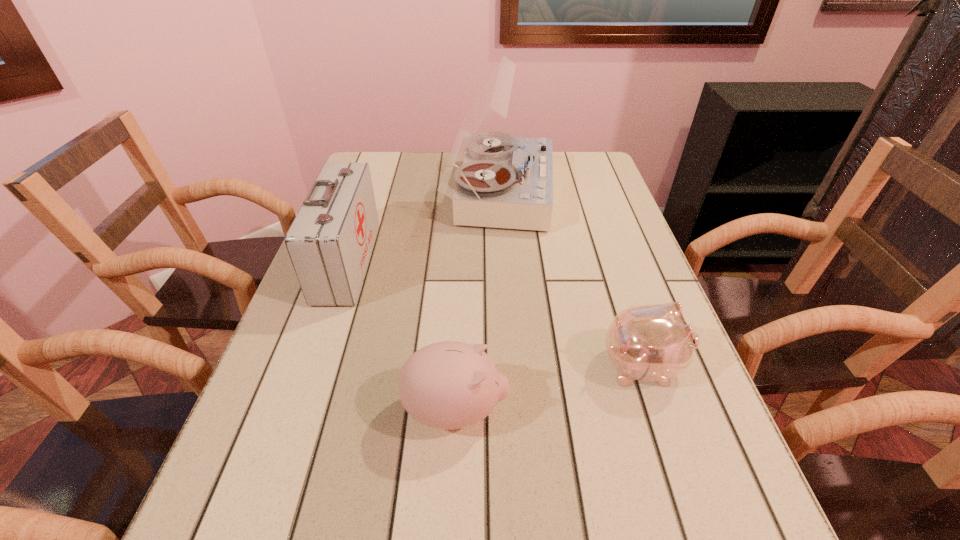
You are a GUI agent. You are given a task and a screenshot of the screen. Output one action in this format:
    pyautogui.click(x=<x>, y=<y>)
    Task: Click on the unoccupied area between the left piggy bank and the record player
    
    Given the screenshot: What is the action you would take?
    pyautogui.click(x=478, y=301)

The image size is (960, 540). I want to click on free space between the rightmost object and the left piggy bank, so click(549, 388).

This screenshot has height=540, width=960. Identify the location of empty space that is in between the rightmost object and the left piggy bank. (549, 388).

Find the location of a particular element. The image size is (960, 540). free space between the left piggy bank and the record player is located at coordinates (478, 301).

Select which object appears as the third closest to the record player. Please provide its 2D coordinates. Your answer should be formatted as a tuple, i.e. [(x, y)], where the tuple contains the x and y coordinates of a point satisfying the conditions above.

[(447, 385)]

Select which object is the closest to the record player. Please provide its 2D coordinates. Your answer should be formatted as a tuple, i.e. [(x, y)], where the tuple contains the x and y coordinates of a point satisfying the conditions above.

[(330, 241)]